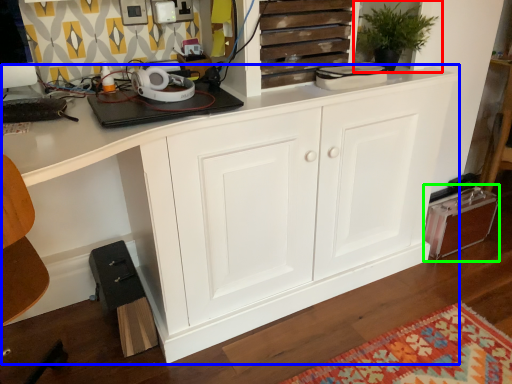
Question: Which object is positioned closest to houseplant (highlighted by a red box)? Select from cabinetry (highlighted by a blue box) and cabinetry (highlighted by a green box).

Choices:
 (A) cabinetry
 (B) cabinetry

Answer: (A)